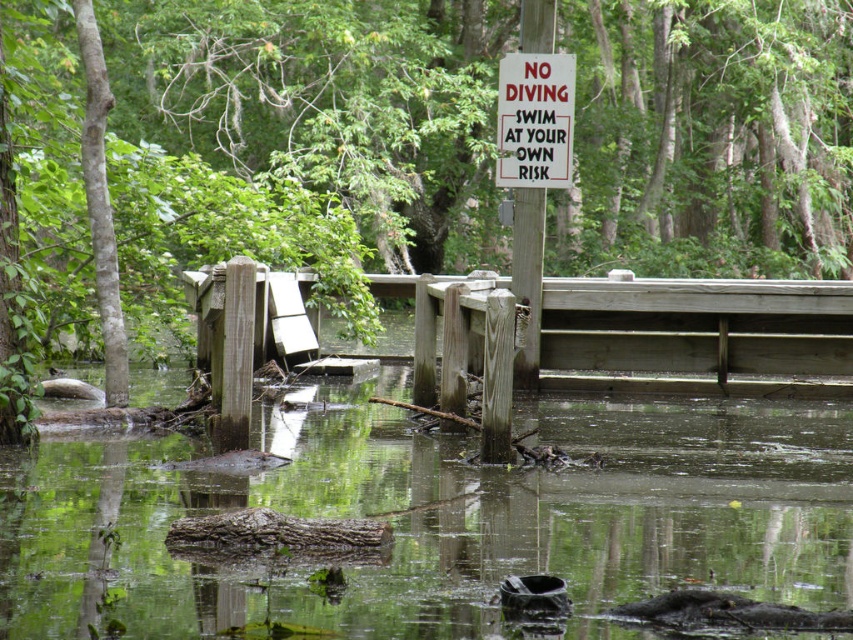
Question: Estimate the real-world distances between objects in this image. Which object is closer to the white paper sign at upper center?

Choices:
 (A) white wood sign at center
 (B) weathered wood dock at center

Answer: (A)

Question: Which is nearer to the clear water at center?

Choices:
 (A) weathered wood dock at center
 (B) white wood sign at center
 (C) green leafy tree at upper center
 (D) white paper sign at upper center

Answer: (B)

Question: Is green leafy tree at upper center above white paper sign at upper center?

Choices:
 (A) yes
 (B) no

Answer: (A)

Question: Which object is the closest to the weathered wood dock at center?

Choices:
 (A) white wood sign at center
 (B) white paper sign at upper center
 (C) green leafy tree at upper center

Answer: (A)

Question: Is green leafy tree at upper center below clear water at center?

Choices:
 (A) no
 (B) yes

Answer: (A)

Question: Can you confirm if weathered wood dock at center is positioned to the right of white paper sign at upper center?

Choices:
 (A) no
 (B) yes

Answer: (B)